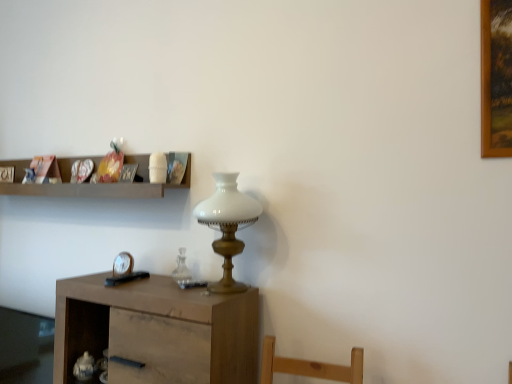
Question: Should I look upward or downward to see white glass table lamp at center?

Choices:
 (A) down
 (B) up

Answer: (A)

Question: Would you say wooden picture frame at upper left, the 1th picture frame positioned from the back, is a long distance from metallic silver picture frame at upper center, which appears as the first picture frame when viewed from the right?

Choices:
 (A) yes
 (B) no

Answer: (B)

Question: Is wooden picture frame at upper left, which is the 1th picture frame in left-to-right order, taller than metallic silver picture frame at upper center, which is the 2th picture frame from back to front?

Choices:
 (A) yes
 (B) no

Answer: (B)

Question: Does wooden picture frame at upper left, which is the 1th picture frame in left-to-right order, have a smaller size compared to metallic silver picture frame at upper center, which appears as the first picture frame when viewed from the right?

Choices:
 (A) yes
 (B) no

Answer: (A)

Question: Does wooden picture frame at upper left, the second picture frame in the front-to-back sequence, lie in front of metallic silver picture frame at upper center, which is the 2th picture frame from back to front?

Choices:
 (A) yes
 (B) no

Answer: (B)

Question: Is wooden picture frame at upper left, the 1th picture frame positioned from the back, further to camera compared to metallic silver picture frame at upper center, positioned as the second picture frame in left-to-right order?

Choices:
 (A) yes
 (B) no

Answer: (A)

Question: Is wooden picture frame at upper left, which is the 1th picture frame in left-to-right order, positioned with its back to metallic silver picture frame at upper center, positioned as the first picture frame in front-to-back order?

Choices:
 (A) yes
 (B) no

Answer: (B)

Question: Is metallic silver picture frame at upper center, which is the 2th picture frame from back to front, surrounding metallic silver clock at lower left?

Choices:
 (A) no
 (B) yes

Answer: (A)

Question: From a real-world perspective, is metallic silver picture frame at upper center, which is the 2th picture frame from back to front, on metallic silver clock at lower left?

Choices:
 (A) no
 (B) yes

Answer: (B)

Question: Is metallic silver picture frame at upper center, which appears as the first picture frame when viewed from the right, located outside metallic silver clock at lower left?

Choices:
 (A) no
 (B) yes

Answer: (B)

Question: Is metallic silver picture frame at upper center, positioned as the second picture frame in left-to-right order, aimed at metallic silver clock at lower left?

Choices:
 (A) yes
 (B) no

Answer: (B)

Question: From a real-world perspective, does metallic silver picture frame at upper center, which appears as the first picture frame when viewed from the right, sit lower than metallic silver clock at lower left?

Choices:
 (A) no
 (B) yes

Answer: (A)

Question: Considering the relative positions of metallic silver picture frame at upper center, positioned as the second picture frame in left-to-right order, and metallic silver clock at lower left in the image provided, is metallic silver picture frame at upper center, positioned as the second picture frame in left-to-right order, to the left of metallic silver clock at lower left from the viewer's perspective?

Choices:
 (A) no
 (B) yes

Answer: (A)

Question: Is metallic silver picture frame at upper center, which appears as the first picture frame when viewed from the right, surrounded by metallic silver clock at lower left?

Choices:
 (A) yes
 (B) no

Answer: (B)